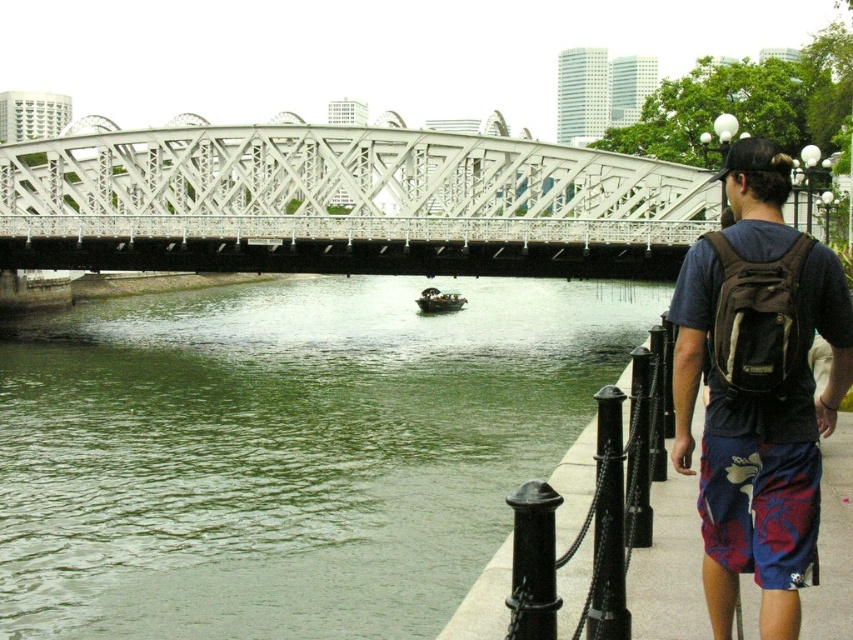
Which is below, green water at center or wooden boat at center?

green water at center is below.

Who is positioned more to the right, green water at center or wooden boat at center?

Positioned to the right is wooden boat at center.

Image resolution: width=853 pixels, height=640 pixels. Describe the element at coordinates (285, 451) in the screenshot. I see `green water at center` at that location.

You are a GUI agent. You are given a task and a screenshot of the screen. Output one action in this format:
    pyautogui.click(x=<x>, y=<y>)
    Task: Click on the green water at center
    This screenshot has width=853, height=640.
    Given the screenshot: What is the action you would take?
    pyautogui.click(x=285, y=451)

Does floral print shorts at lower right have a greater width compared to wooden boat at center?

Incorrect, floral print shorts at lower right's width does not surpass wooden boat at center's.

Who is taller, floral print shorts at lower right or wooden boat at center?

With more height is floral print shorts at lower right.

The width and height of the screenshot is (853, 640). What do you see at coordinates (761, 508) in the screenshot?
I see `floral print shorts at lower right` at bounding box center [761, 508].

This screenshot has height=640, width=853. I want to click on floral print shorts at lower right, so click(761, 508).

How much distance is there between green water at center and floral print shorts at lower right?

green water at center and floral print shorts at lower right are 49.60 meters apart.

Is green water at center closer to camera compared to floral print shorts at lower right?

No.

Which is in front, point (424, 394) or point (776, 540)?

Positioned in front is point (776, 540).

At what (x,y) coordinates should I click in order to perform the action: click on green water at center. Please return your answer as a coordinate pair (x, y). Looking at the image, I should click on (285, 451).